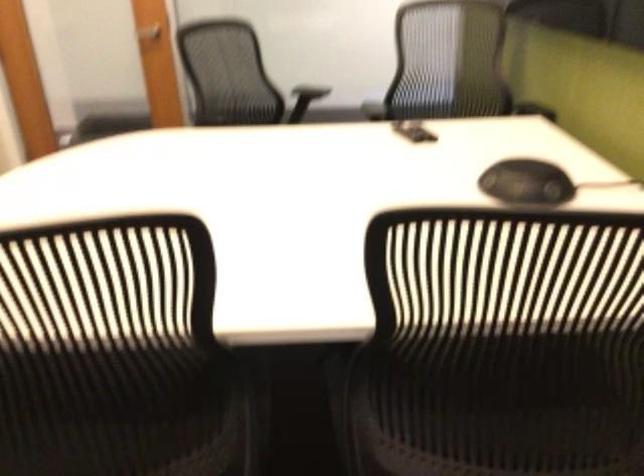
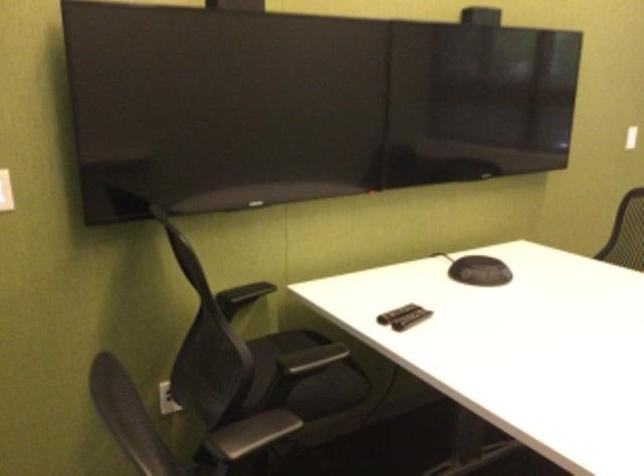
Find the pixel in the second image that matches point (422, 128) in the first image.

(395, 313)